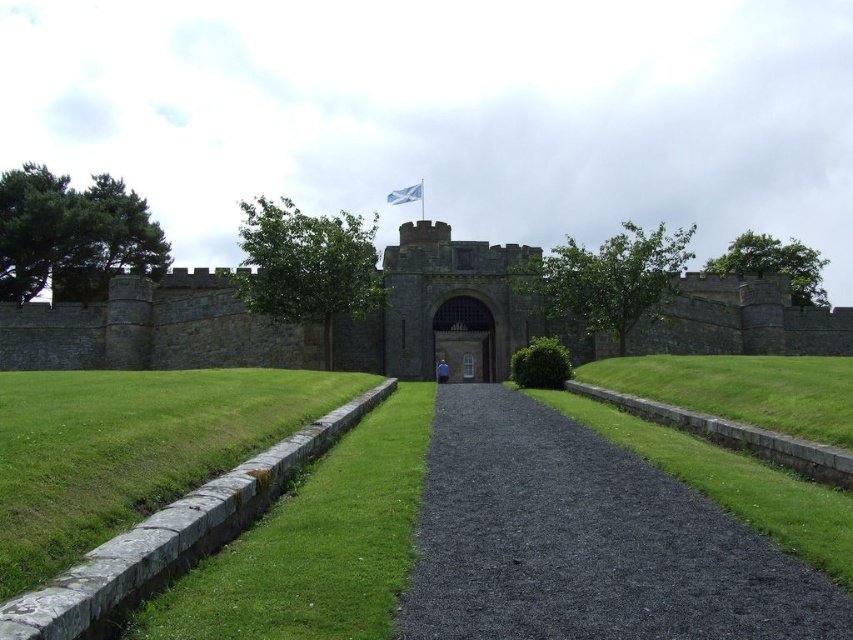
You are a tourist standing at the entrance of the historic stone castle. You see the green grass at center and the dark stone gate at center. Which object is positioned to the right side from your perspective?

The green grass at center is positioned to the right of the dark stone gate at center, so the green grass at center is on the right side.

You are a gardener tasked with mowing the lawn at the historic stone castle. You notice two areas of green grass at lower left and green grass at center. Which area requires more time to mow based on their sizes?

The green grass at center requires more time to mow because it occupies more space than the green grass at lower left.

You are a visitor approaching the castle entrance. You need to walk from the green grass at lower left to the castle gate. Is the black gravel path at center between you and the gate?

The black gravel path at center is positioned under green grass at lower left, meaning the path is between you and the castle gate. Therefore, you should walk along the black gravel path at center to reach the gate.